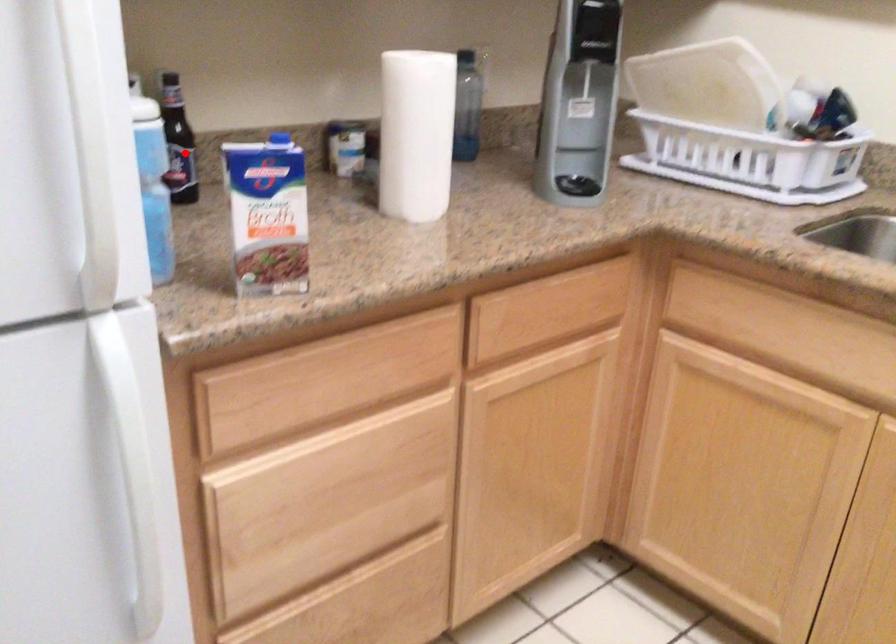
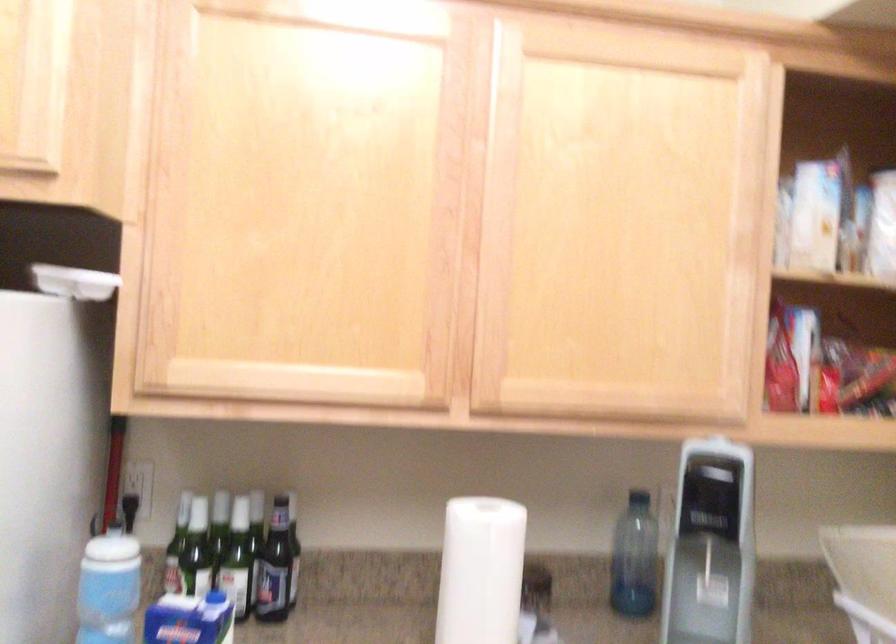
Find the pixel in the second image that matches the highlighted location in the first image.

(274, 567)